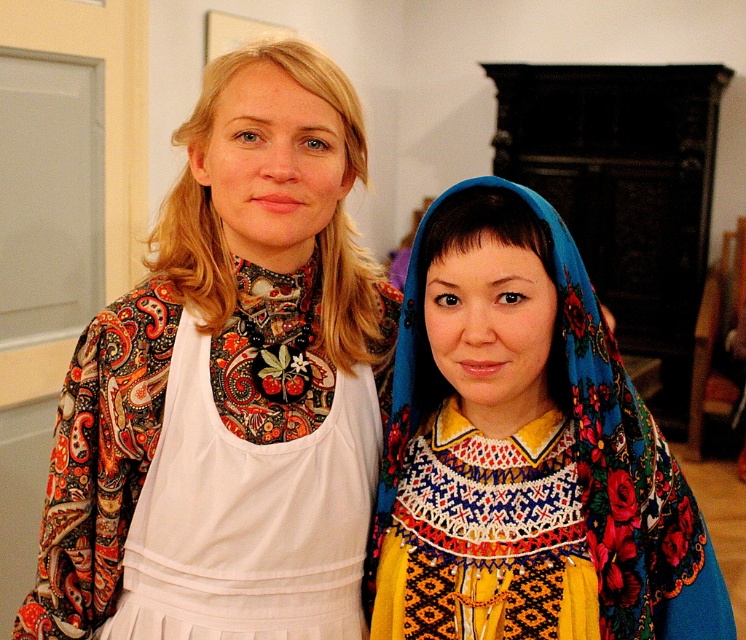
Question: Is the position of floral fabric headscarf at center less distant than that of white fabric apron at center?

Choices:
 (A) yes
 (B) no

Answer: (A)

Question: Does floral fabric headscarf at center have a lesser width compared to white fabric apron at center?

Choices:
 (A) no
 (B) yes

Answer: (A)

Question: Based on their relative distances, which object is farther from the floral fabric headscarf at center?

Choices:
 (A) matte floral kimono at center
 (B) white fabric apron at center

Answer: (A)

Question: Does matte floral kimono at center appear on the right side of white fabric apron at center?

Choices:
 (A) no
 (B) yes

Answer: (A)

Question: Among these objects, which one is farthest from the camera?

Choices:
 (A) white fabric apron at center
 (B) matte floral kimono at center
 (C) floral fabric headscarf at center

Answer: (A)

Question: Among these points, which one is nearest to the camera?

Choices:
 (A) (295, 556)
 (B) (289, 465)
 (C) (592, 570)

Answer: (C)